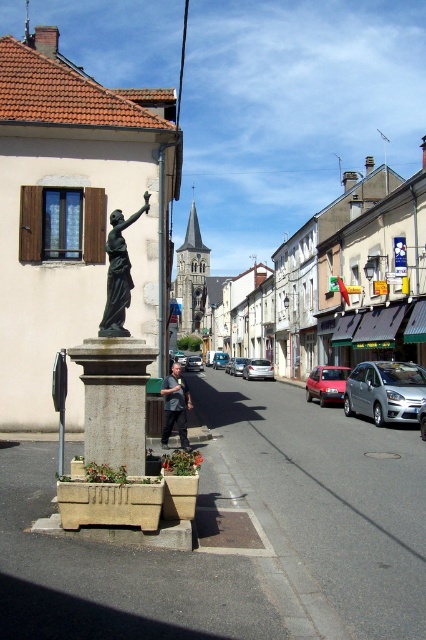
Question: Which object appears farthest from the camera in this image?

Choices:
 (A) dark gray shirt at center
 (B) satin silver car at center

Answer: (B)

Question: Among these points, which one is farthest from the camera?

Choices:
 (A) (299, 356)
 (B) (250, 362)
 (C) (189, 355)
 (D) (118, 244)

Answer: (C)

Question: Can you confirm if dark gray shirt at center is thinner than silver metallic car at center?

Choices:
 (A) yes
 (B) no

Answer: (A)

Question: Does dark gray shirt at center appear on the right side of matte red car at center?

Choices:
 (A) yes
 (B) no

Answer: (B)

Question: Considering the relative positions of bronze statue at center and matte red car at center in the image provided, where is bronze statue at center located with respect to matte red car at center?

Choices:
 (A) right
 (B) left

Answer: (B)

Question: Which of the following is the closest to the observer?

Choices:
 (A) (388, 193)
 (B) (189, 362)

Answer: (A)